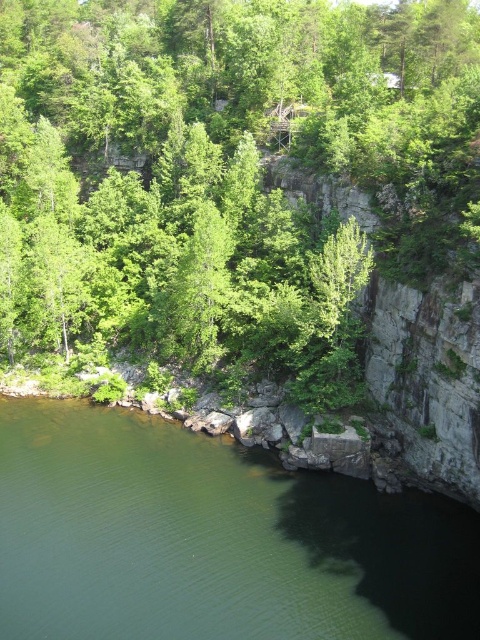
Question: Is green leafy tree at upper center closer to the viewer compared to green smooth water at lower left?

Choices:
 (A) no
 (B) yes

Answer: (A)

Question: Is green leafy tree at upper center to the left of green smooth water at lower left from the viewer's perspective?

Choices:
 (A) no
 (B) yes

Answer: (B)

Question: Is green leafy tree at upper center to the left of green smooth water at lower left from the viewer's perspective?

Choices:
 (A) yes
 (B) no

Answer: (A)